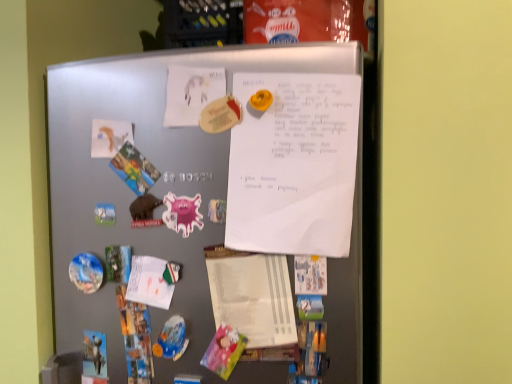
Question: Would you consider satin silver refrigerator at center to be distant from matte paper poster at upper center, positioned as the 1th poster in left-to-right order?

Choices:
 (A) no
 (B) yes

Answer: (A)

Question: Is satin silver refrigerator at center thinner than matte paper poster at upper center, the 2th poster when ordered from right to left?

Choices:
 (A) no
 (B) yes

Answer: (A)

Question: Is satin silver refrigerator at center closer to the viewer compared to matte paper poster at upper center, positioned as the 1th poster in left-to-right order?

Choices:
 (A) yes
 (B) no

Answer: (A)

Question: Is matte paper poster at upper center, the 2th poster when ordered from right to left, inside satin silver refrigerator at center?

Choices:
 (A) no
 (B) yes

Answer: (B)

Question: Is satin silver refrigerator at center at the left side of matte paper poster at upper center, the 2th poster when ordered from right to left?

Choices:
 (A) yes
 (B) no

Answer: (B)

Question: From a real-world perspective, is white paper notepad at center above or below satin silver refrigerator at center?

Choices:
 (A) below
 (B) above

Answer: (A)

Question: Relative to satin silver refrigerator at center, is white paper notepad at center in front or behind?

Choices:
 (A) behind
 (B) front

Answer: (A)

Question: Visually, is white paper notepad at center positioned to the left or to the right of satin silver refrigerator at center?

Choices:
 (A) left
 (B) right

Answer: (B)

Question: In terms of size, does white paper notepad at center appear bigger or smaller than satin silver refrigerator at center?

Choices:
 (A) small
 (B) big

Answer: (A)

Question: Is point (180, 226) closer or farther from the camera than point (229, 263)?

Choices:
 (A) closer
 (B) farther

Answer: (B)

Question: In the image, is pink glossy magnet at center-left positioned in front of or behind white paper notepad at center?

Choices:
 (A) front
 (B) behind

Answer: (B)

Question: Based on their sizes in the image, would you say pink glossy magnet at center-left is bigger or smaller than white paper notepad at center?

Choices:
 (A) big
 (B) small

Answer: (B)

Question: Is pink glossy magnet at center-left wider or thinner than white paper notepad at center?

Choices:
 (A) wide
 (B) thin

Answer: (B)

Question: From the image's perspective, is white paper notepad at center located above or below white matte paper at upper left?

Choices:
 (A) below
 (B) above

Answer: (A)

Question: In terms of height, does white paper notepad at center look taller or shorter compared to white matte paper at upper left?

Choices:
 (A) tall
 (B) short

Answer: (A)